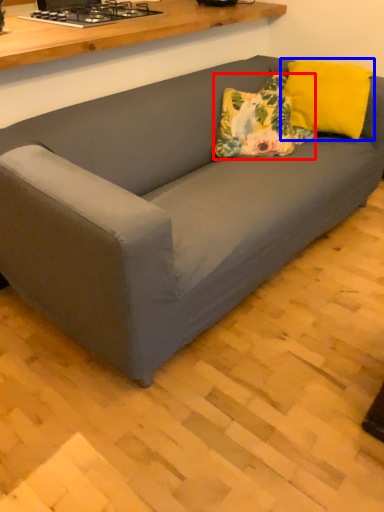
Question: Which object appears closest to the camera in this image, throw pillow (highlighted by a red box) or pillow (highlighted by a blue box)?

Choices:
 (A) throw pillow
 (B) pillow

Answer: (A)